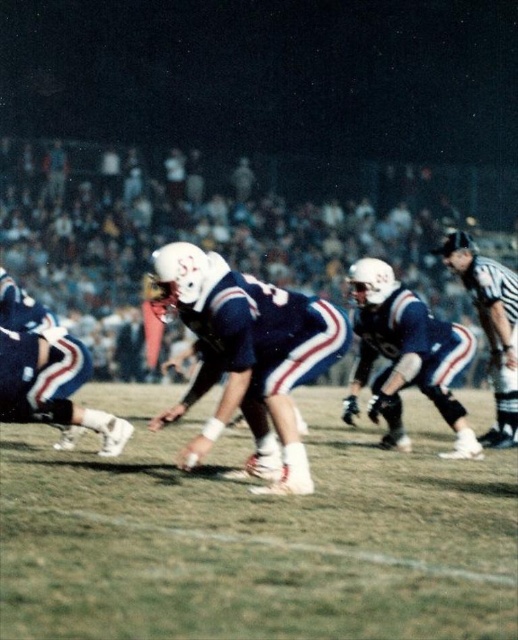
Can you confirm if blue fabric uniform at center is thinner than black uniformed figure at right?

In fact, blue fabric uniform at center might be wider than black uniformed figure at right.

Which is behind, point (179, 301) or point (492, 284)?

The point (492, 284) is more distant.

The width and height of the screenshot is (518, 640). What are the coordinates of `blue fabric uniform at center` in the screenshot? It's located at (323, 346).

Is green grass at center to the left of black uniformed figure at right from the viewer's perspective?

Correct, you'll find green grass at center to the left of black uniformed figure at right.

Measure the distance between point (x=469, y=625) and camera.

Point (x=469, y=625) is 3.49 meters from camera.

Image resolution: width=518 pixels, height=640 pixels. I want to click on green grass at center, so click(x=254, y=534).

Is point (279, 508) farther from viewer compared to point (199, 355)?

No, (279, 508) is in front of (199, 355).

Which is in front, point (85, 531) or point (400, 285)?

Point (85, 531)

Where is `green grass at center`? The width and height of the screenshot is (518, 640). green grass at center is located at coordinates (254, 534).